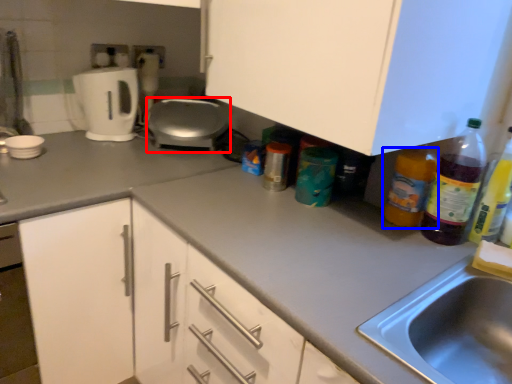
Question: Which object is further to the camera taking this photo, appliance (highlighted by a red box) or bottle (highlighted by a blue box)?

Choices:
 (A) appliance
 (B) bottle

Answer: (A)